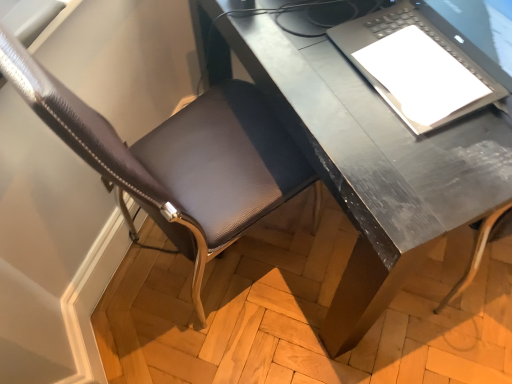
Identify the location of vacant space situated on the left part of matte black laptop at upper right. The image size is (512, 384). (305, 60).